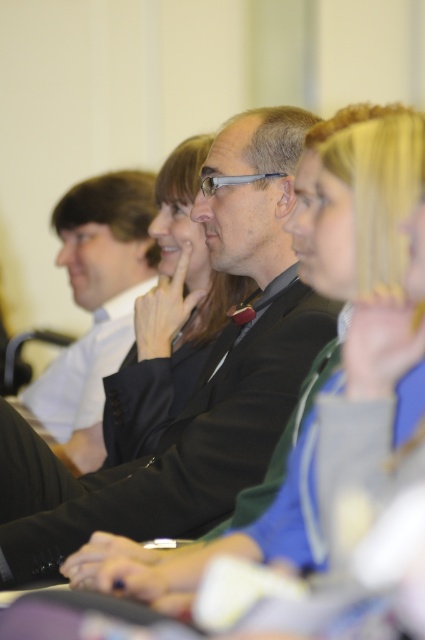
You are an event planner trying to arrange a photo shoot in the conference room. You need to place a large banner behind the main speaker. The banner requires a clear space behind the matte black suit at center and smooth black jacket at center. Which object should you position the banner behind to ensure it is visible to the camera?

The banner should be positioned behind the smooth black jacket at center because it is farther from the viewer compared to the matte black suit at center, ensuring the banner remains visible and unobstructed.

You are standing in the conference room and want to walk to the point that is closer to the attendees. Which point should you go to? The point at coordinates (68, 394) or the point at (184, 268)?

You should go to the point at (184, 268) because it is closer to the attendees than the point at (68, 394).

You are standing in the conference room and want to move from the point at coordinate (232,228) to the point at coordinate (209,348). Is the destination point closer to the front of the room or the back?

The point at coordinate (209,348) is closer to the back of the room because point (232,228) is in front of it.